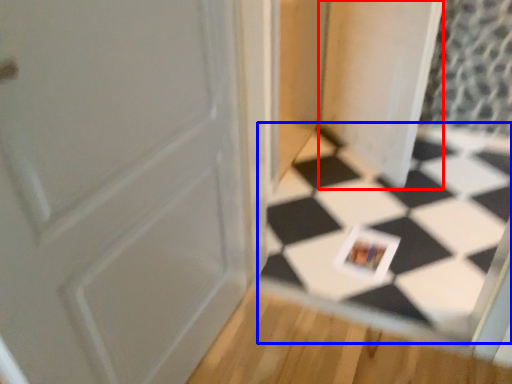
Question: Which of the following is the farthest to the observer, screen door (highlighted by a red box) or square (highlighted by a blue box)?

Choices:
 (A) screen door
 (B) square

Answer: (A)